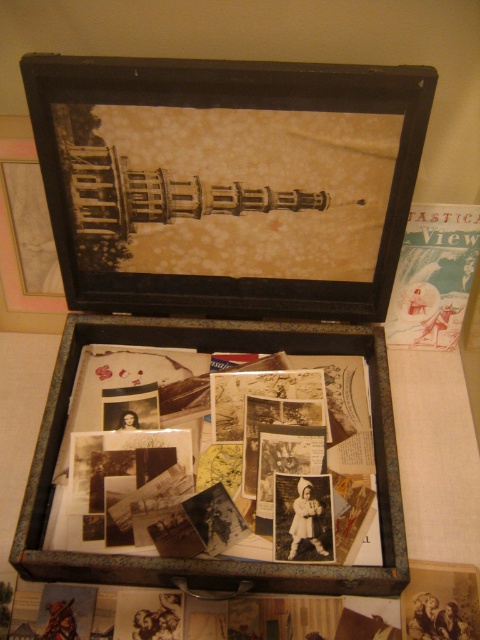
You are an antique collector examining the items in the image. You want to determine which item is nearer to you. Which one is closer to you between the metallic suitcase at center and the gold metallic tower at upper center?

The metallic suitcase at center is closer to the viewer than the gold metallic tower at upper center.

You are packing a vintage suitcase for a trip and need to place the gold metallic tower at upper center and the blue paper postcard at upper right inside. Based on their sizes, which item should you place first to ensure both fit properly?

The gold metallic tower at upper center might be wider than the blue paper postcard at upper right, so you should place the wider item first to ensure both fit properly.